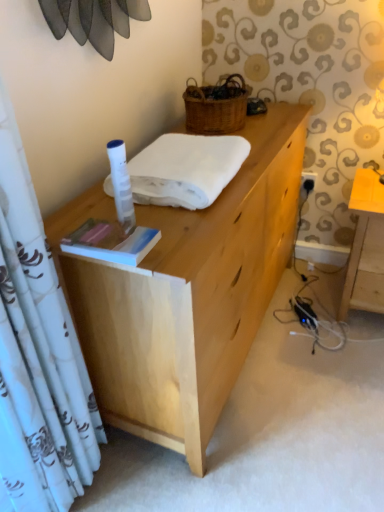
Question: Is light brown wooden table at right far away from natural wood desk at center?

Choices:
 (A) yes
 (B) no

Answer: (B)

Question: Can you confirm if light brown wooden table at right is smaller than natural wood desk at center?

Choices:
 (A) no
 (B) yes

Answer: (B)

Question: Is light brown wooden table at right outside natural wood desk at center?

Choices:
 (A) yes
 (B) no

Answer: (A)

Question: Can you confirm if light brown wooden table at right is wider than natural wood desk at center?

Choices:
 (A) no
 (B) yes

Answer: (A)

Question: Is light brown wooden table at right turned away from natural wood desk at center?

Choices:
 (A) yes
 (B) no

Answer: (B)

Question: Considering the relative positions of light brown wooden table at right and natural wood desk at center in the image provided, is light brown wooden table at right to the left of natural wood desk at center from the viewer's perspective?

Choices:
 (A) no
 (B) yes

Answer: (A)

Question: Is white soft towel at center behind woven brown picnic basket at upper center?

Choices:
 (A) no
 (B) yes

Answer: (A)

Question: From the image's perspective, is white soft towel at center located beneath woven brown picnic basket at upper center?

Choices:
 (A) no
 (B) yes

Answer: (B)

Question: Can you confirm if white soft towel at center is positioned to the left of woven brown picnic basket at upper center?

Choices:
 (A) no
 (B) yes

Answer: (B)

Question: Is white soft towel at center beside woven brown picnic basket at upper center?

Choices:
 (A) yes
 (B) no

Answer: (B)

Question: Does white soft towel at center have a larger size compared to woven brown picnic basket at upper center?

Choices:
 (A) no
 (B) yes

Answer: (B)

Question: Could you tell me if white soft towel at center is facing woven brown picnic basket at upper center?

Choices:
 (A) yes
 (B) no

Answer: (B)

Question: Considering the relative positions of hardcover book at center and white soft towel at center in the image provided, is hardcover book at center to the left of white soft towel at center from the viewer's perspective?

Choices:
 (A) no
 (B) yes

Answer: (B)